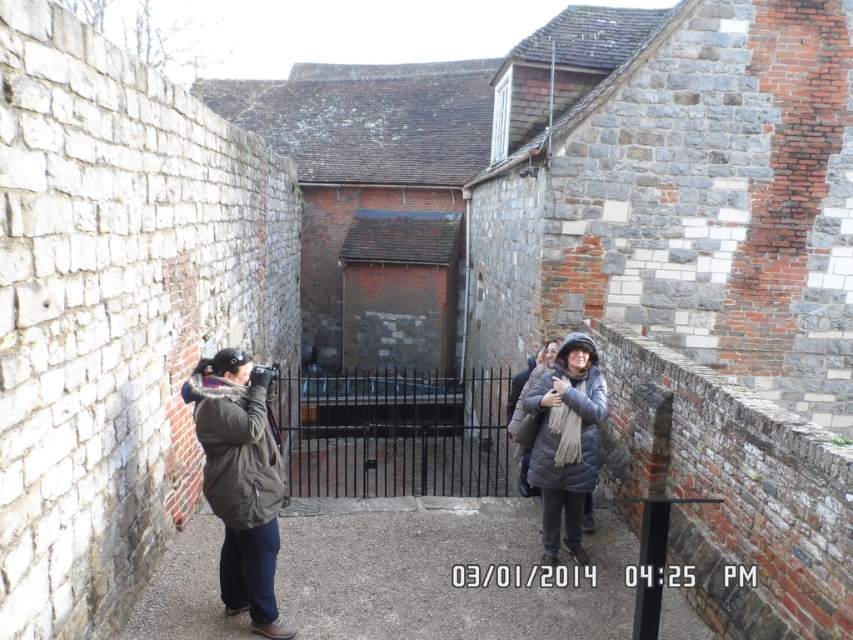
You are standing at the entrance of the historic area and need to take a photo of both the dark green jacket at center and the matte gray coat at center. The camera you have can focus on objects up to 10 feet away. Can you capture both subjects in one shot without moving?

The dark green jacket at center is 8.17 feet from matte gray coat at center. Since both are within the 10 feet range of your camera, you can capture both subjects in one shot without moving.

You are standing at the point labeled as point (241, 481) in the image. What object or feature is directly beneath your feet?

The point (241, 481) is located on the dark green jacket at center, so the dark green jacket is directly beneath your feet.

You are standing in the historic area and want to take a photo of the dark green jacket at center and the matte gray coat at center. Which one is closer to the ground?

The dark green jacket at center is located below matte gray coat at center, so it is closer to the ground.